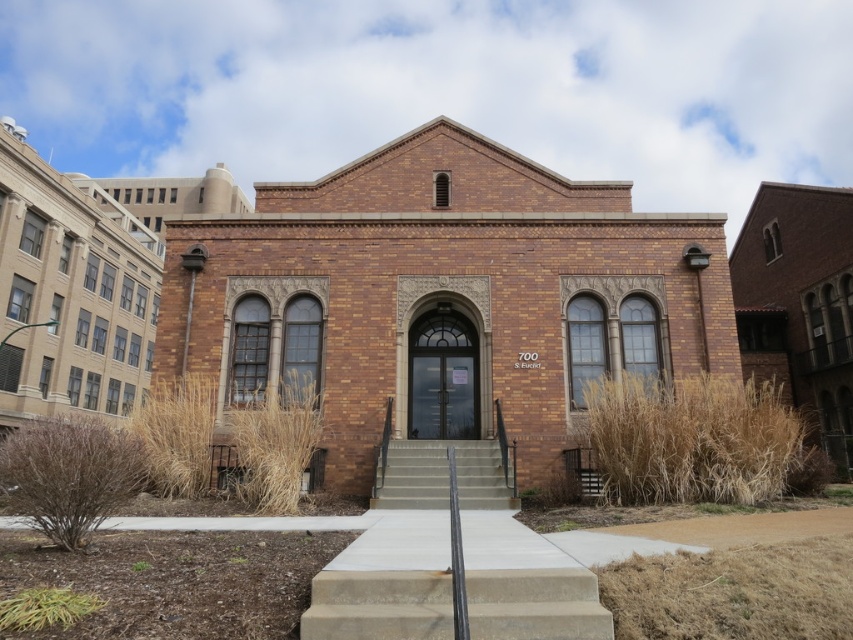
You are standing at the center of the image. Where is the brown brick church at center located in relation to your position?

The brown brick church at center is located at point (70, 292) relative to your position at the center of the image.